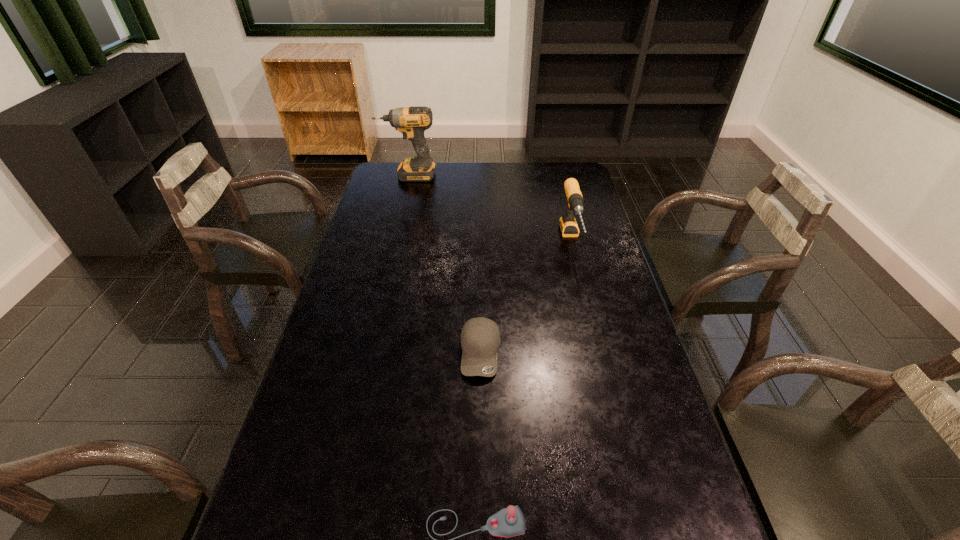
This screenshot has width=960, height=540. I want to click on object that stands as the closest to the baseball cap, so click(508, 522).